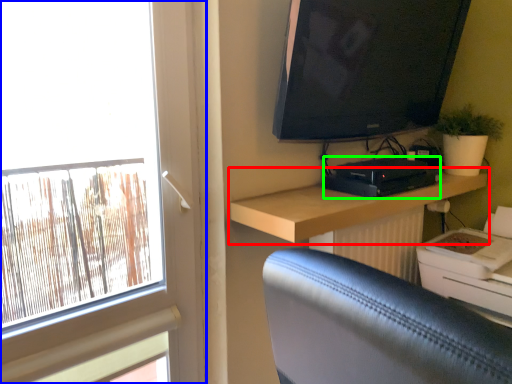
Question: Considering the real-world distances, which object is farthest from shelf (highlighted by a red box)? window (highlighted by a blue box) or equipment (highlighted by a green box)?

Choices:
 (A) window
 (B) equipment

Answer: (A)